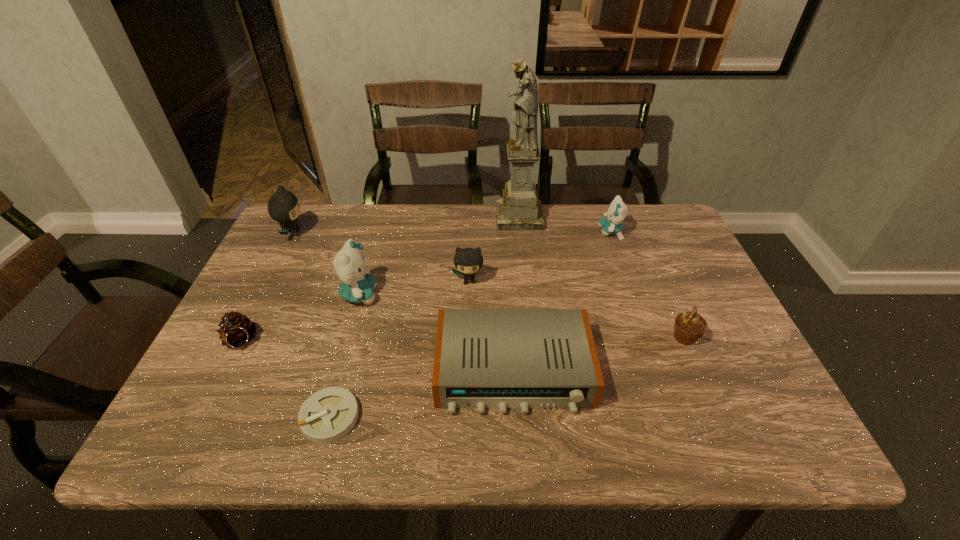
Locate an element on the screen. object that stands as the sixth closest to the radio receiver is located at coordinates (519, 209).

Locate which kitten is the second closest to the brown pinecone. Please provide its 2D coordinates. Your answer should be formatted as a tuple, i.e. [(x, y)], where the tuple contains the x and y coordinates of a point satisfying the conditions above.

[(283, 207)]

Identify the location of the closest kitten relative to the leftmost kitten. This screenshot has width=960, height=540. (357, 285).

Where is `vacant space that satisfies the following two spatial constraints: 1. on the front-facing side of the farther gray kitten; 2. on the back side of the gray ashtray`? This screenshot has height=540, width=960. vacant space that satisfies the following two spatial constraints: 1. on the front-facing side of the farther gray kitten; 2. on the back side of the gray ashtray is located at coordinates (200, 417).

Locate an element on the screen. The image size is (960, 540). vacant region that satisfies the following two spatial constraints: 1. on the face of the smaller blue kitten; 2. on the control panel of the radio receiver is located at coordinates (660, 371).

The image size is (960, 540). Identify the location of blank area in the image that satisfies the following two spatial constraints: 1. on the front-facing side of the left gray kitten; 2. on the right side of the shortest object. (200, 417).

Identify the location of vacant space that satisfies the following two spatial constraints: 1. on the front-facing side of the smaller gray kitten; 2. on the face of the nearer blue kitten. (468, 294).

Where is `vacant space that satisfies the following two spatial constraints: 1. on the front-facing side of the tallest object; 2. on the front-facing side of the right gray kitten`? vacant space that satisfies the following two spatial constraints: 1. on the front-facing side of the tallest object; 2. on the front-facing side of the right gray kitten is located at coordinates (526, 281).